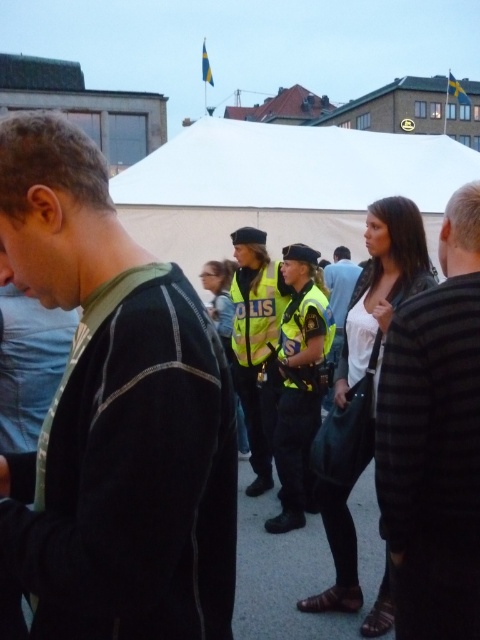
Does reflective yellow vest at center have a greater height compared to white shirt at center?

Yes.

Between reflective yellow vest at center and white shirt at center, which one has less height?

white shirt at center is shorter.

The height and width of the screenshot is (640, 480). What do you see at coordinates (300, 384) in the screenshot?
I see `reflective yellow vest at center` at bounding box center [300, 384].

This screenshot has width=480, height=640. In order to click on reflective yellow vest at center in this screenshot , I will do `click(300, 384)`.

Is point (467, 516) positioned before point (242, 241)?

Yes, point (467, 516) is closer to viewer.

Is point (408, 474) positioned in front of point (256, 234)?

Yes.

Locate an element on the screen. This screenshot has width=480, height=640. striped fabric jacket at center is located at coordinates (434, 440).

Does black matte jacket at left have a lesser height compared to reflective yellow vest at center?

Yes, black matte jacket at left is shorter than reflective yellow vest at center.

Is black matte jacket at left smaller than reflective yellow vest at center?

No, black matte jacket at left is not smaller than reflective yellow vest at center.

Is point (179, 461) closer to camera compared to point (312, 365)?

Yes.

I want to click on black matte jacket at left, so click(x=113, y=416).